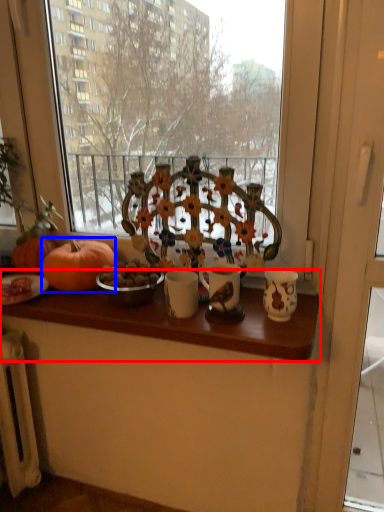
Question: Which object is closer to the camera taking this photo, table (highlighted by a red box) or pumpkin (highlighted by a blue box)?

Choices:
 (A) table
 (B) pumpkin

Answer: (A)